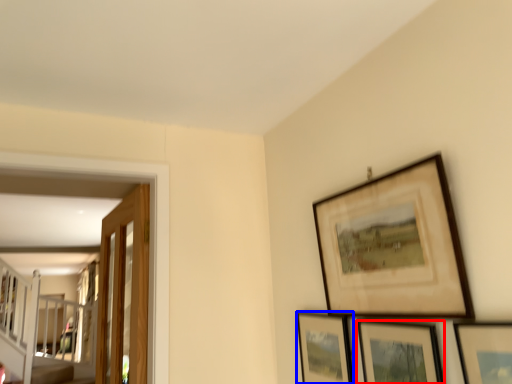
Question: Which object is closer to the camera taking this photo, picture frame (highlighted by a red box) or picture frame (highlighted by a blue box)?

Choices:
 (A) picture frame
 (B) picture frame

Answer: (A)